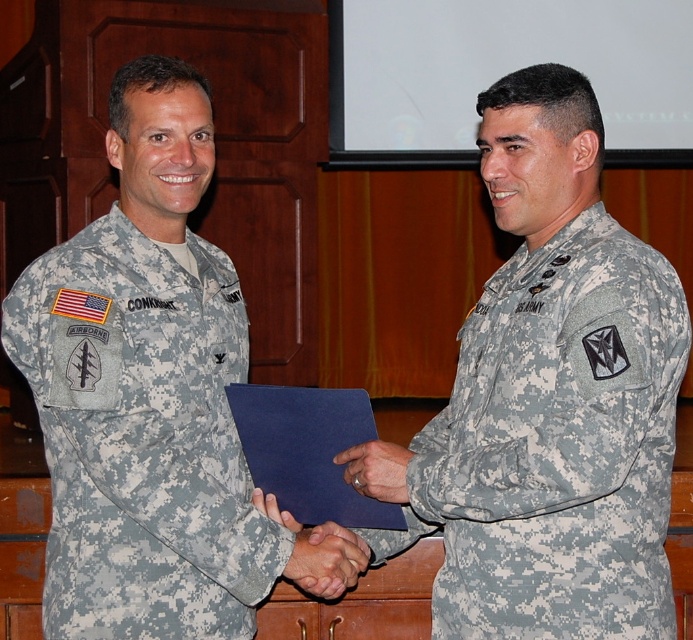
Can you confirm if camouflage uniform at center is smaller than camouflage fabric uniform at left?

Incorrect, camouflage uniform at center is not smaller in size than camouflage fabric uniform at left.

From the picture: Can you confirm if camouflage uniform at center is positioned to the right of camouflage fabric uniform at left?

Indeed, camouflage uniform at center is positioned on the right side of camouflage fabric uniform at left.

Which is in front, point (574, 508) or point (218, 368)?

Positioned in front is point (574, 508).

You are a GUI agent. You are given a task and a screenshot of the screen. Output one action in this format:
    pyautogui.click(x=<x>, y=<y>)
    Task: Click on the camouflage uniform at center
    This screenshot has width=693, height=640.
    Given the screenshot: What is the action you would take?
    pyautogui.click(x=545, y=401)